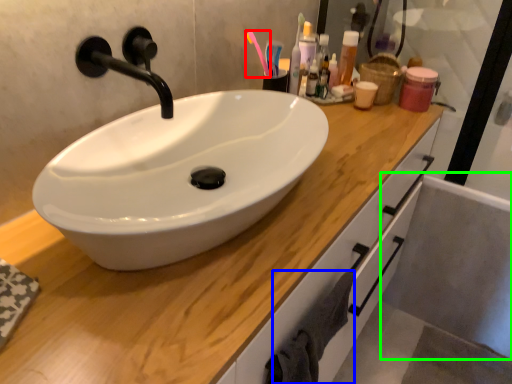
Question: Which is farther away from toothbrush (highlighted by a red box)? bath towel (highlighted by a blue box) or bath (highlighted by a green box)?

Choices:
 (A) bath towel
 (B) bath

Answer: (B)